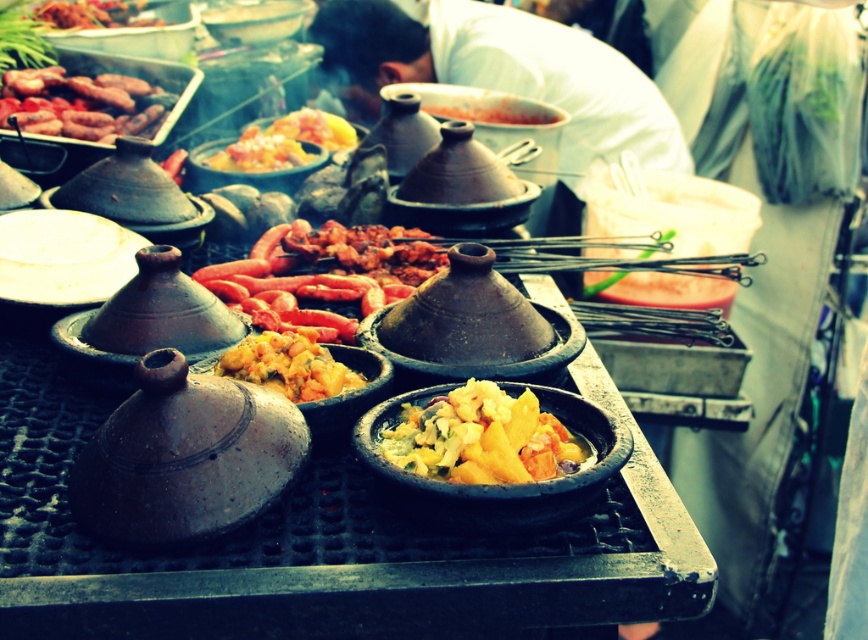
Question: Among these points, which one is farthest from the camera?

Choices:
 (A) (494, 52)
 (B) (148, 20)
 (C) (250, 259)

Answer: (B)

Question: Is matte ceramic bowl at upper center positioned behind matte clay bowl at center?

Choices:
 (A) yes
 (B) no

Answer: (A)

Question: Based on their relative distances, which object is nearer to the brown glossy sausages at left?

Choices:
 (A) matte ceramic bowl at upper center
 (B) yellowish matte food at center
 (C) matte brown meat at upper left
 (D) matte clay bowl at center

Answer: (D)

Question: Is yellowish matte tagine at center in front of matte brown meat at upper left?

Choices:
 (A) yes
 (B) no

Answer: (A)

Question: Is yellowish matte clay bowl at center above matte ceramic bowl at upper center?

Choices:
 (A) no
 (B) yes

Answer: (A)

Question: Which of the following is the closest to the observer?

Choices:
 (A) matte brown meat at upper left
 (B) matte ceramic bowl at upper center

Answer: (A)